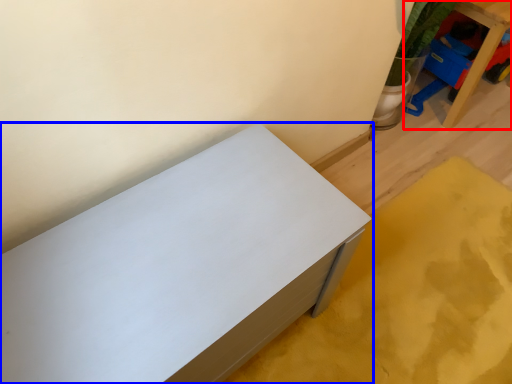
Question: Which object is closer to the camera taking this photo, furniture (highlighted by a red box) or furniture (highlighted by a blue box)?

Choices:
 (A) furniture
 (B) furniture

Answer: (B)